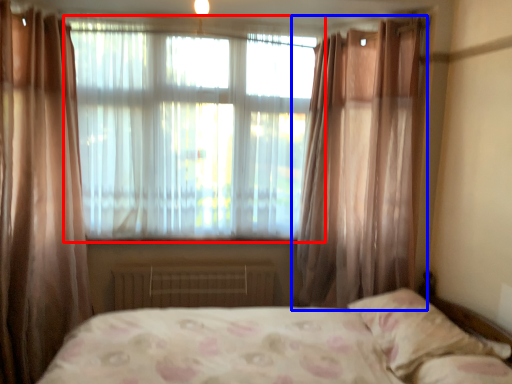
Question: Which object is closer to the camera taking this photo, window (highlighted by a red box) or curtain (highlighted by a blue box)?

Choices:
 (A) window
 (B) curtain

Answer: (B)